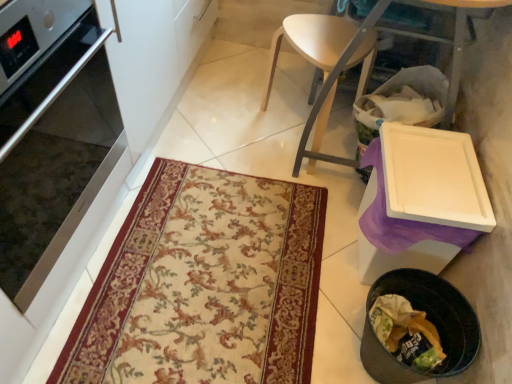
Question: Is satin silver oven at left at the left side of beige floral rug at center?

Choices:
 (A) yes
 (B) no

Answer: (A)

Question: Is satin silver oven at left turned away from beige floral rug at center?

Choices:
 (A) no
 (B) yes

Answer: (A)

Question: Can you confirm if satin silver oven at left is shorter than beige floral rug at center?

Choices:
 (A) yes
 (B) no

Answer: (B)

Question: Could you tell me if satin silver oven at left is turned towards beige floral rug at center?

Choices:
 (A) no
 (B) yes

Answer: (B)

Question: Can you confirm if satin silver oven at left is smaller than beige floral rug at center?

Choices:
 (A) no
 (B) yes

Answer: (A)

Question: Is light wood chair at center inside or outside of white plastic cutting board at right?

Choices:
 (A) inside
 (B) outside

Answer: (A)

Question: Is light wood chair at center taller or shorter than white plastic cutting board at right?

Choices:
 (A) tall
 (B) short

Answer: (B)

Question: From a real-world perspective, is light wood chair at center above or below white plastic cutting board at right?

Choices:
 (A) below
 (B) above

Answer: (A)

Question: Considering the positions of point (359, 44) and point (314, 109), is point (359, 44) closer or farther from the camera than point (314, 109)?

Choices:
 (A) closer
 (B) farther

Answer: (A)

Question: From a real-world perspective, is black plastic trash can at lower right above or below beige floral rug at center?

Choices:
 (A) above
 (B) below

Answer: (A)

Question: Relative to beige floral rug at center, is black plastic trash can at lower right in front or behind?

Choices:
 (A) behind
 (B) front

Answer: (B)

Question: Based on their positions, is black plastic trash can at lower right located to the left or right of beige floral rug at center?

Choices:
 (A) left
 (B) right

Answer: (B)

Question: In terms of height, does black plastic trash can at lower right look taller or shorter compared to beige floral rug at center?

Choices:
 (A) short
 (B) tall

Answer: (B)

Question: Based on their positions, is beige floral rug at center located to the left or right of white plastic cutting board at right?

Choices:
 (A) right
 (B) left

Answer: (B)

Question: From their relative heights in the image, would you say beige floral rug at center is taller or shorter than white plastic cutting board at right?

Choices:
 (A) tall
 (B) short

Answer: (B)